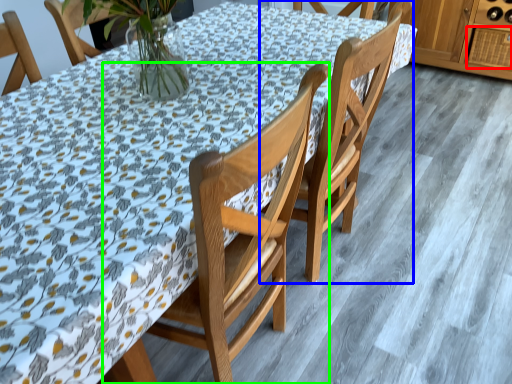
Question: Which is farther away from drawer (highlighted by a red box)? chair (highlighted by a blue box) or chair (highlighted by a green box)?

Choices:
 (A) chair
 (B) chair

Answer: (B)